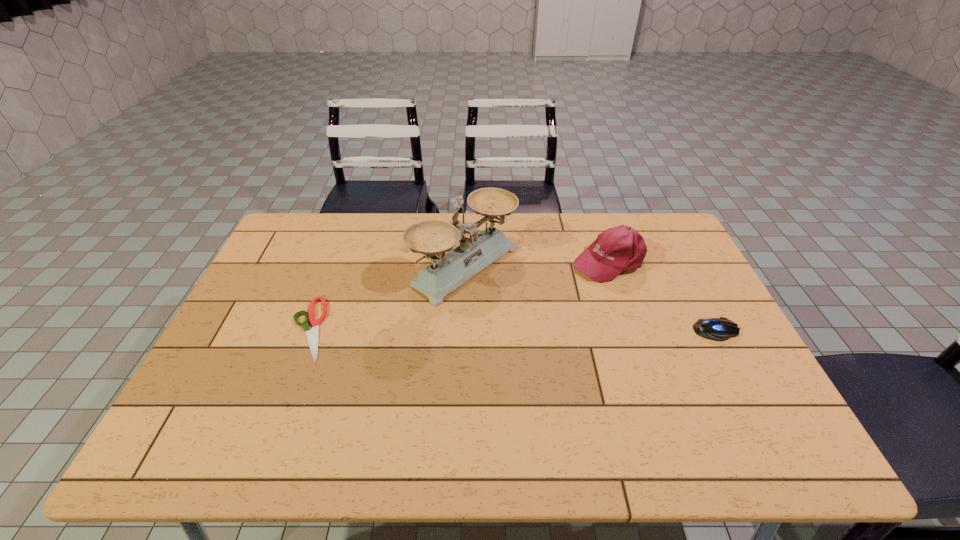
This screenshot has width=960, height=540. Find the location of `free space located at the front of the baseball cap with the brim`. free space located at the front of the baseball cap with the brim is located at coordinates (555, 284).

Find the location of a particular element. free space located at the front of the baseball cap with the brim is located at coordinates (555, 284).

Identify the location of free location located 0.250m on the front-facing side of the scale. (578, 338).

The height and width of the screenshot is (540, 960). Find the location of `vacant point located on the front-facing side of the scale`. vacant point located on the front-facing side of the scale is located at coordinates (523, 303).

The width and height of the screenshot is (960, 540). What are the coordinates of `blank area located on the front-facing side of the scale` in the screenshot? It's located at (575, 336).

Image resolution: width=960 pixels, height=540 pixels. In order to click on baseball cap that is at the far edge in this screenshot , I will do `click(618, 249)`.

You are a GUI agent. You are given a task and a screenshot of the screen. Output one action in this format:
    pyautogui.click(x=<x>, y=<y>)
    Task: Click on the scale that is at the far edge
    The image size is (960, 540).
    Given the screenshot: What is the action you would take?
    pyautogui.click(x=432, y=238)

Find the location of a particular element. Image resolution: width=960 pixels, height=540 pixels. computer mouse positioned at the right edge is located at coordinates (720, 329).

The height and width of the screenshot is (540, 960). In order to click on baseball cap present at the right edge in this screenshot , I will do `click(618, 249)`.

This screenshot has width=960, height=540. Identify the location of object that is positioned at the far right corner. (618, 249).